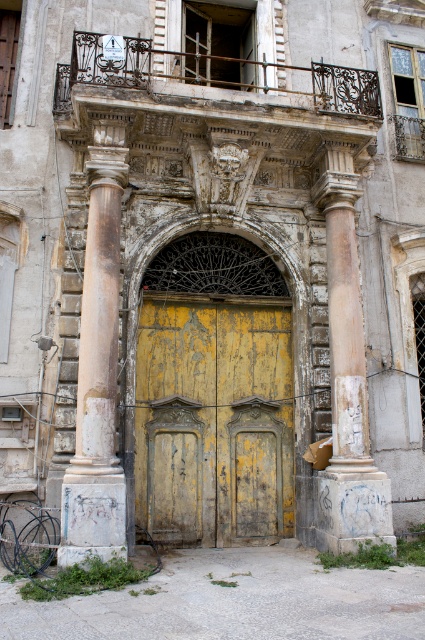
Question: Which point is farther to the camera?

Choices:
 (A) (104, 442)
 (B) (246, 509)

Answer: (B)

Question: Is yellow weathered wood door at center to the left of white marble column at center from the viewer's perspective?

Choices:
 (A) yes
 (B) no

Answer: (A)

Question: Which point is farther to the camera?

Choices:
 (A) (382, 474)
 (B) (139, 452)
 (C) (98, 200)

Answer: (B)

Question: Is yellow weathered wood door at center to the left of white stone column at left from the viewer's perspective?

Choices:
 (A) no
 (B) yes

Answer: (A)

Question: Can you confirm if white stone column at left is positioned to the left of white marble column at center?

Choices:
 (A) yes
 (B) no

Answer: (A)

Question: Which of the following is the closest to the observer?

Choices:
 (A) (118, 490)
 (B) (249, 504)
 (C) (336, 388)

Answer: (A)